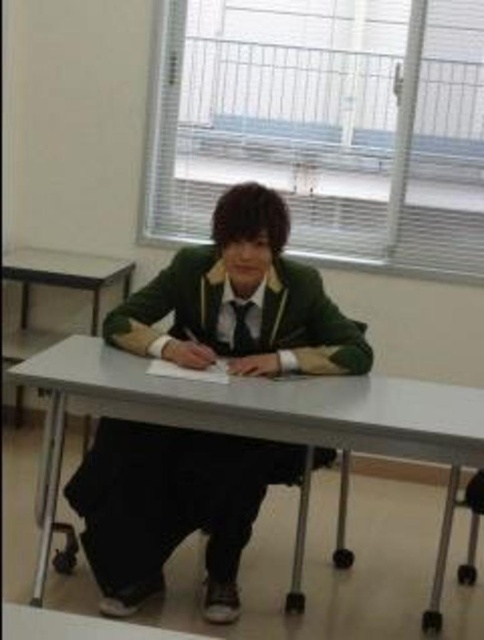
Question: From the image, what is the correct spatial relationship of white plastic table at center in relation to matte black tie at center?

Choices:
 (A) above
 (B) below

Answer: (B)

Question: Which point appears farthest from the camera in this image?

Choices:
 (A) (176, 460)
 (B) (81, 404)

Answer: (A)

Question: Does green fabric uniform at center appear over white plastic table at center?

Choices:
 (A) yes
 (B) no

Answer: (B)

Question: Among these points, which one is nearest to the camera?

Choices:
 (A) (265, 468)
 (B) (179, 412)

Answer: (B)

Question: Which of the following is the closest to the observer?

Choices:
 (A) green fabric uniform at center
 (B) white plastic table at center
 (C) matte black tie at center

Answer: (B)

Question: From the image, what is the correct spatial relationship of white plastic table at center in relation to matte black tie at center?

Choices:
 (A) below
 (B) above

Answer: (A)